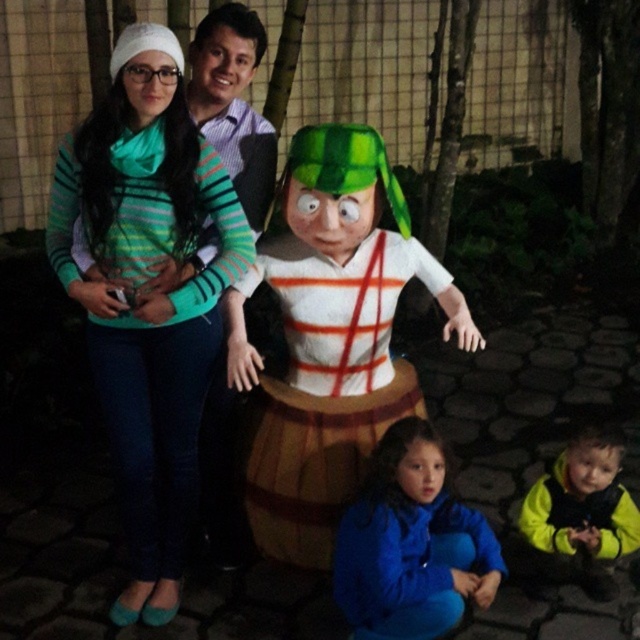
Question: Considering the relative positions of wooden barrel at center and matte green fabric at center in the image provided, where is wooden barrel at center located with respect to matte green fabric at center?

Choices:
 (A) below
 (B) above

Answer: (A)

Question: Can you confirm if wooden barrel at center is positioned below blue fleece jacket at lower center?

Choices:
 (A) yes
 (B) no

Answer: (B)

Question: Is green striped sweater at upper left thinner than matte green fabric at center?

Choices:
 (A) yes
 (B) no

Answer: (B)

Question: Which of the following is the closest to the observer?

Choices:
 (A) green striped sweater at upper left
 (B) yellow fleece jacket at lower right
 (C) wooden barrel at center

Answer: (A)

Question: Which point is farther to the camera?

Choices:
 (A) green striped sweater at upper left
 (B) yellow fleece jacket at lower right
 (C) wooden barrel at center

Answer: (C)

Question: Which of the following is the closest to the observer?

Choices:
 (A) (420, 413)
 (B) (202, 385)

Answer: (B)